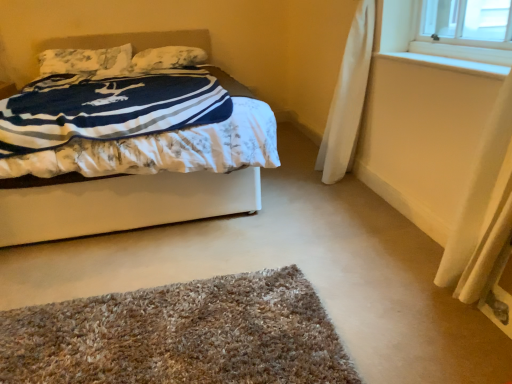
Question: Is white soft pillow at upper center, which ranks as the 1th pillow in right-to-left order, thinner than white fabric bed at center?

Choices:
 (A) no
 (B) yes

Answer: (B)

Question: Is white soft pillow at upper center, which ranks as the 1th pillow in right-to-left order, wider than white fabric bed at center?

Choices:
 (A) no
 (B) yes

Answer: (A)

Question: Is white soft pillow at upper center, the second pillow positioned from the left, surrounding white fabric bed at center?

Choices:
 (A) yes
 (B) no

Answer: (B)

Question: From the image's perspective, is white soft pillow at upper center, which ranks as the 1th pillow in right-to-left order, above white fabric bed at center?

Choices:
 (A) no
 (B) yes

Answer: (B)

Question: Is white soft pillow at upper center, the second pillow positioned from the left, to the right of white fabric bed at center from the viewer's perspective?

Choices:
 (A) no
 (B) yes

Answer: (B)

Question: Is white soft pillow at upper center, which ranks as the 1th pillow in right-to-left order, positioned far away from white fabric bed at center?

Choices:
 (A) yes
 (B) no

Answer: (A)

Question: Considering the relative sizes of white fabric bed at center and white wood at upper right in the image provided, is white fabric bed at center bigger than white wood at upper right?

Choices:
 (A) yes
 (B) no

Answer: (A)

Question: Can you confirm if white fabric bed at center is thinner than white wood at upper right?

Choices:
 (A) yes
 (B) no

Answer: (B)

Question: Would you say white fabric bed at center is outside white wood at upper right?

Choices:
 (A) no
 (B) yes

Answer: (B)

Question: Can you confirm if white fabric bed at center is smaller than white wood at upper right?

Choices:
 (A) no
 (B) yes

Answer: (A)

Question: Can white wood at upper right be found inside white fabric bed at center?

Choices:
 (A) yes
 (B) no

Answer: (B)

Question: Is white fabric bed at center further to the viewer compared to white wood at upper right?

Choices:
 (A) yes
 (B) no

Answer: (A)

Question: Considering the relative sizes of brown shaggy rug at lower center and white fabric bed at center in the image provided, is brown shaggy rug at lower center smaller than white fabric bed at center?

Choices:
 (A) yes
 (B) no

Answer: (A)